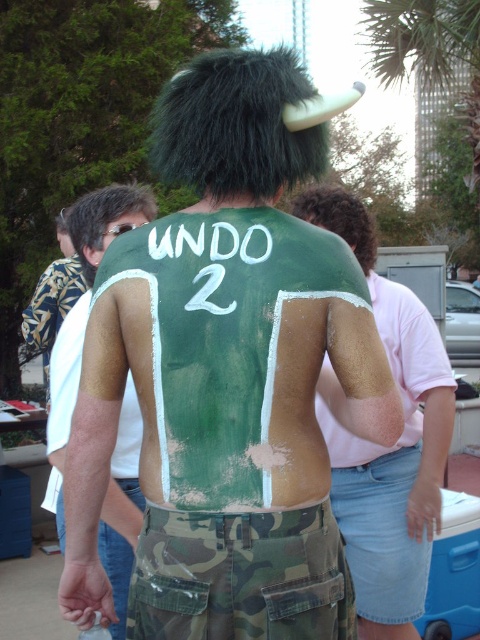
From the picture: Who is taller, green matte paint at center or white chalk writing at center back?

green matte paint at center

Between point (380, 582) and point (162, 285), which one is positioned behind?

The point (380, 582) is behind.

Where is `green matte paint at center`? green matte paint at center is located at coordinates (387, 448).

Find the location of `green matte body paint at center`. green matte body paint at center is located at coordinates (227, 376).

Does point (228, 145) come closer to viewer compared to point (278, 524)?

No, (228, 145) is further to viewer.

Is point (167, 84) behind point (307, 547)?

Yes, it is behind point (307, 547).

This screenshot has width=480, height=640. I want to click on green matte body paint at center, so click(x=227, y=376).

Describe the element at coordinates (208, 259) in the screenshot. The height and width of the screenshot is (640, 480). I see `white chalk writing at center back` at that location.

Between white chalk writing at center back and matte gold shirt at upper right, which one is positioned lower?

matte gold shirt at upper right is lower down.

Is point (241, 234) farther from viewer compared to point (414, 420)?

That is False.

Locate an element on the screen. white chalk writing at center back is located at coordinates point(208,259).